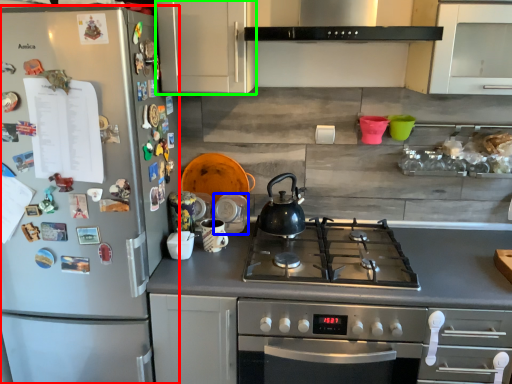
Question: Which object is the closest to the refrigerator (highlighted by a red box)? Choose among these: appliance (highlighted by a blue box) or cabinetry (highlighted by a green box).

Choices:
 (A) appliance
 (B) cabinetry

Answer: (B)